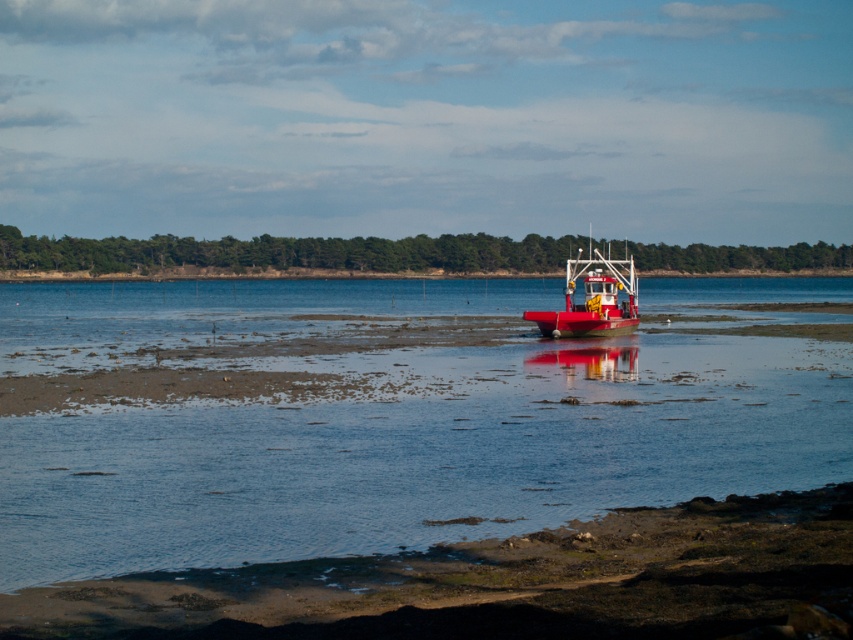
Is point (770, 285) more distant than point (582, 545)?

Yes, point (770, 285) is behind point (582, 545).

Looking at this image, between clear water at center and brown sandy mud at lower center, which one is positioned higher?

clear water at center is higher up.

Who is more forward, (599, 472) or (840, 616)?

Point (840, 616) is more forward.

Where is `clear water at center`? This screenshot has width=853, height=640. clear water at center is located at coordinates (x=390, y=416).

Is point (689, 358) closer to viewer compared to point (566, 269)?

Yes.

Does clear water at center have a greater width compared to shiny red boat at center?

Yes, clear water at center is wider than shiny red boat at center.

Between point (403, 465) and point (598, 280), which one is positioned in front?

Point (403, 465) is more forward.

Image resolution: width=853 pixels, height=640 pixels. I want to click on clear water at center, so click(390, 416).

Is brown sandy mud at lower center further to the viewer compared to shiny red boat at center?

No.

Is point (752, 524) positioned after point (589, 317)?

No, (752, 524) is closer to viewer.

Does point (318, 564) come in front of point (555, 321)?

Yes, point (318, 564) is in front of point (555, 321).

The width and height of the screenshot is (853, 640). Find the location of `brown sandy mud at lower center`. brown sandy mud at lower center is located at coordinates (506, 584).